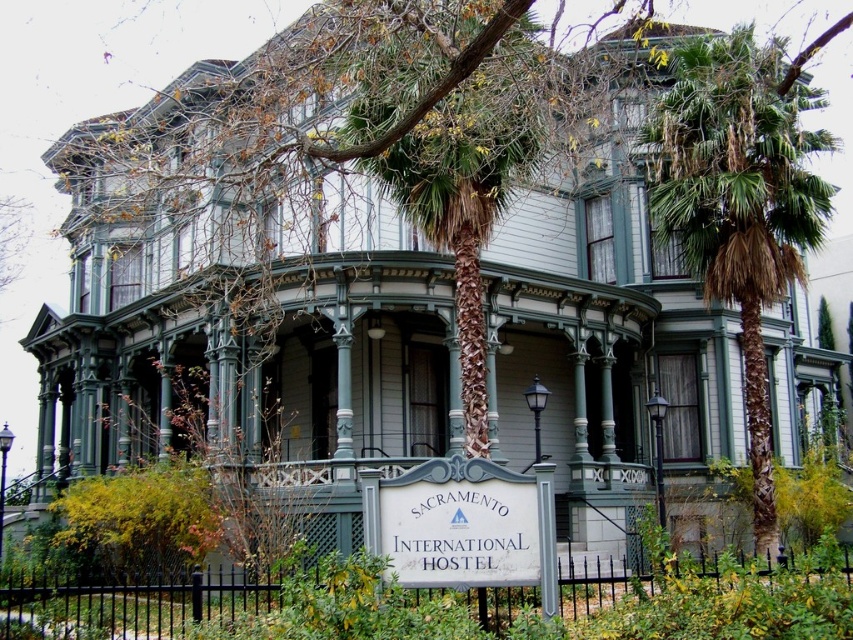
Question: Which object is the farthest from the green textured palm tree at center?

Choices:
 (A) white wood sign at center
 (B) green leafy palm tree at right

Answer: (B)

Question: Does green textured palm tree at center have a larger size compared to white wood sign at center?

Choices:
 (A) yes
 (B) no

Answer: (A)

Question: Is green leafy palm tree at right smaller than white wood sign at center?

Choices:
 (A) no
 (B) yes

Answer: (A)

Question: Which object is closer to the camera taking this photo?

Choices:
 (A) green leafy palm tree at right
 (B) white wood sign at center
 (C) green textured palm tree at center

Answer: (C)

Question: Which object is the farthest from the white wood sign at center?

Choices:
 (A) green leafy palm tree at right
 (B) green textured palm tree at center

Answer: (A)

Question: Where is green leafy palm tree at right located in relation to green textured palm tree at center in the image?

Choices:
 (A) below
 (B) above

Answer: (A)